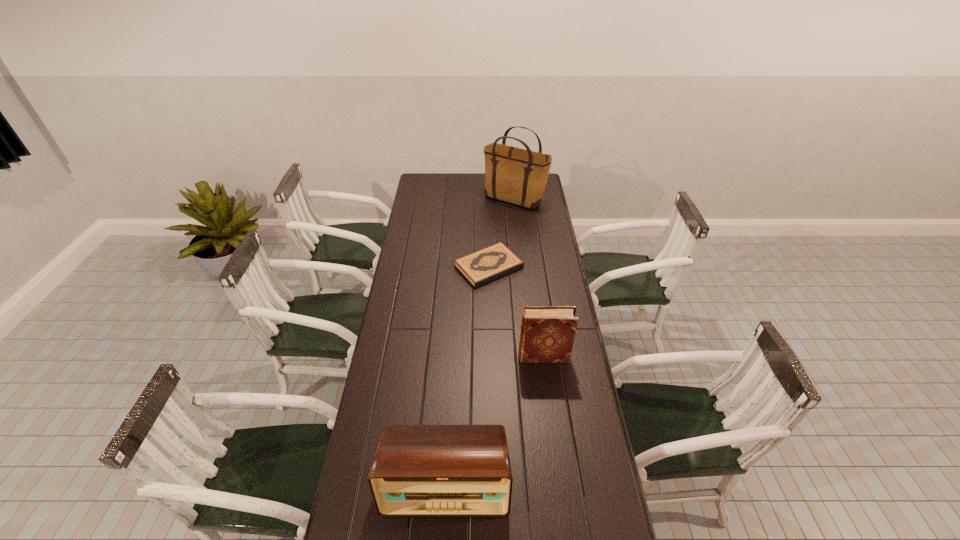
I want to click on free space located 0.330m on the spine side of the taller hardback book, so click(435, 356).

Where is `vacant area situated 0.050m on the left of the shortest object`? This screenshot has width=960, height=540. vacant area situated 0.050m on the left of the shortest object is located at coordinates (444, 267).

Identify the location of object at the far edge. (514, 175).

Where is `object that is at the left edge`? object that is at the left edge is located at coordinates (418, 470).

Identify the location of tote bag that is at the right edge. The height and width of the screenshot is (540, 960). (514, 175).

Find the location of a particular element. This screenshot has height=540, width=960. hardback book located at the right edge is located at coordinates (547, 335).

This screenshot has height=540, width=960. In order to click on object that is at the far right corner in this screenshot , I will do `click(514, 175)`.

You are a GUI agent. You are given a task and a screenshot of the screen. Output one action in this format:
    pyautogui.click(x=<x>, y=<y>)
    Task: Click on the free region at the left edge
    This screenshot has height=540, width=960.
    Given the screenshot: What is the action you would take?
    pyautogui.click(x=396, y=308)

Identify the location of free spot at the right edge of the desktop. (583, 463).

What are the coordinates of `blank space at the far left corner of the desktop` in the screenshot? It's located at [420, 178].